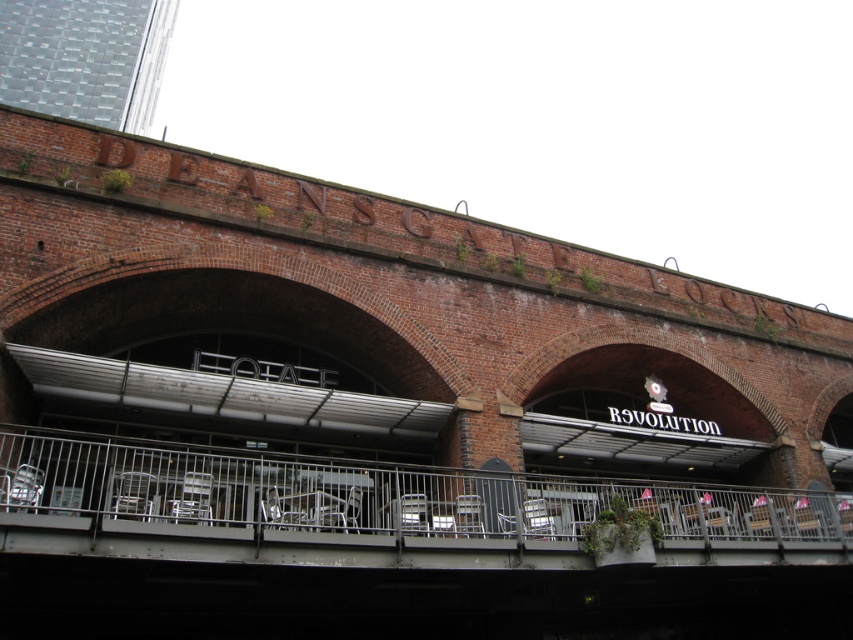
Question: Does brick at center appear under metallic gray railing at center?

Choices:
 (A) yes
 (B) no

Answer: (B)

Question: Which point is farther to the camera?

Choices:
 (A) (28, 538)
 (B) (349, 540)

Answer: (B)

Question: Can you confirm if brick at center is positioned above metallic gray railing at center?

Choices:
 (A) yes
 (B) no

Answer: (A)

Question: Which point appears closest to the camera in this image?

Choices:
 (A) (445, 477)
 (B) (294, 419)

Answer: (A)

Question: Is brick at center bigger than metallic gray railing at center?

Choices:
 (A) yes
 (B) no

Answer: (A)